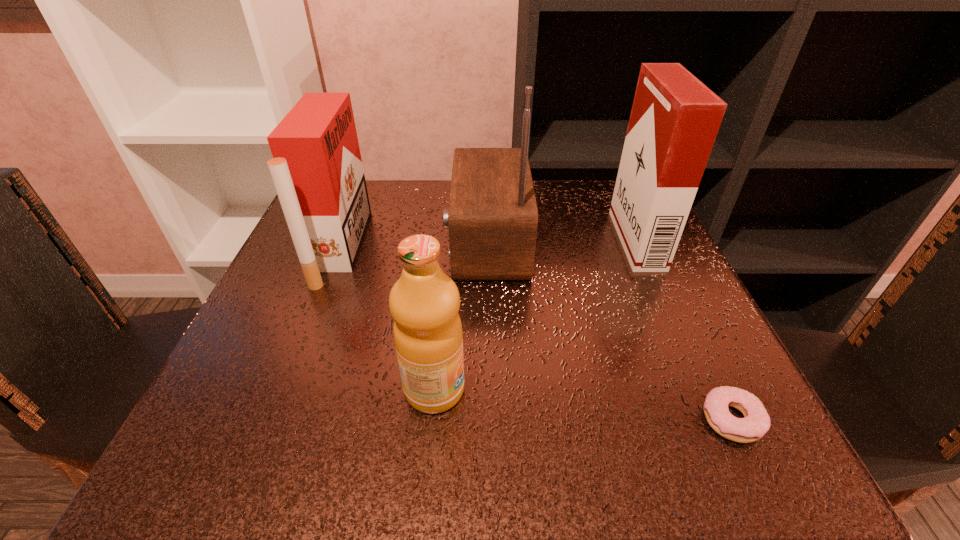
The height and width of the screenshot is (540, 960). I want to click on radio receiver, so click(492, 218).

Identify the location of the right cigarette case. (675, 118).

Identify the location of the shorter cigarette case. (317, 170).

Identify the location of the left cigarette case. The image size is (960, 540). (317, 170).

The image size is (960, 540). What are the coordinates of `fruit juice` in the screenshot? It's located at (424, 302).

Where is `the shortest object`? The width and height of the screenshot is (960, 540). the shortest object is located at coordinates (756, 422).

This screenshot has height=540, width=960. In order to click on free space located on the front-facing side of the radio receiver in this screenshot , I will do `click(356, 241)`.

Locate an element on the screen. vacant space located 0.160m on the front-facing side of the radio receiver is located at coordinates (371, 241).

Locate an element on the screen. blank space located on the front-facing side of the radio receiver is located at coordinates (380, 241).

Image resolution: width=960 pixels, height=540 pixels. In order to click on free spot located 0.250m on the front-facing side of the taller cigarette case in this screenshot , I will do 500,240.